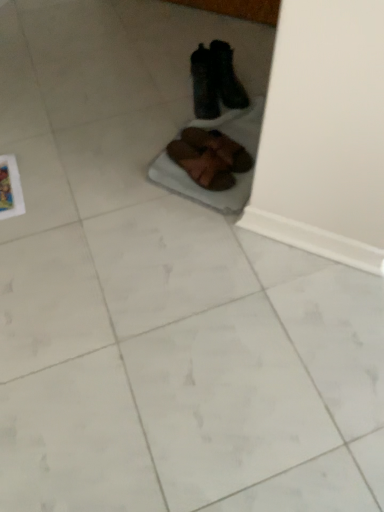
Where is `free space that is to the left of brown suede shoes at center, placed as the 4th footwear when sorted from top to bottom`? This screenshot has height=512, width=384. free space that is to the left of brown suede shoes at center, placed as the 4th footwear when sorted from top to bottom is located at coordinates (x=163, y=170).